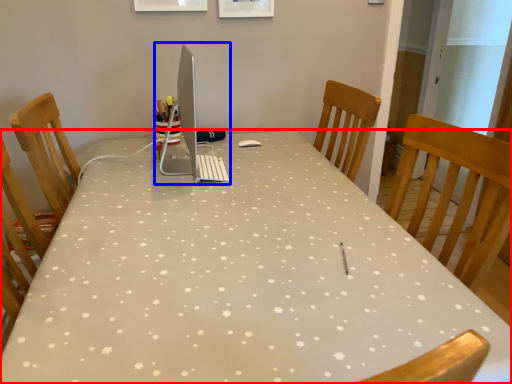
Question: Which of the following is the closest to the observer, table (highlighted by a red box) or desktop computer (highlighted by a blue box)?

Choices:
 (A) table
 (B) desktop computer

Answer: (A)